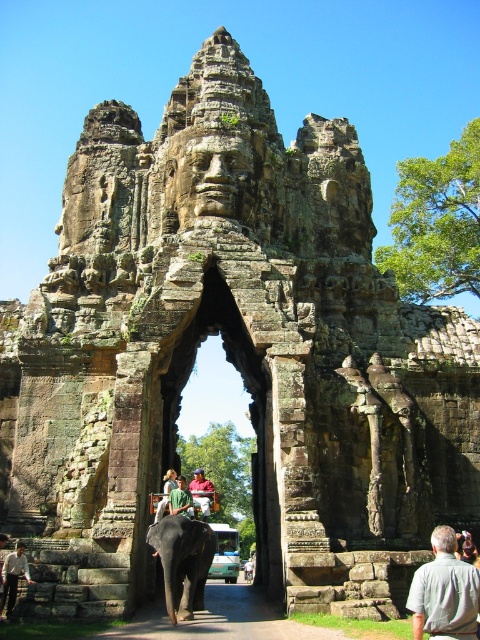
Question: Which object is closer to the camera taking this photo?

Choices:
 (A) brown stone path at center
 (B) light brown leather jacket at lower left
 (C) green fabric person at center
 (D) green fabric shirt at center

Answer: (A)

Question: In this image, where is light brown leather jacket at lower left located relative to green fabric shirt at center?

Choices:
 (A) above
 (B) below

Answer: (A)

Question: Which of the following is the farthest from the observer?

Choices:
 (A) (175, 625)
 (B) (155, 518)
 (C) (192, 484)
 (D) (171, 496)

Answer: (C)

Question: Does gray fabric shirt at lower right appear on the left side of green fabric shirt at center?

Choices:
 (A) yes
 (B) no

Answer: (B)

Question: Is green fabric person at center above light brown leather hat at center?

Choices:
 (A) no
 (B) yes

Answer: (B)

Question: Which point is closer to the camera?

Choices:
 (A) (173, 509)
 (B) (237, 611)
 (C) (432, 577)
 (D) (166, 500)

Answer: (C)